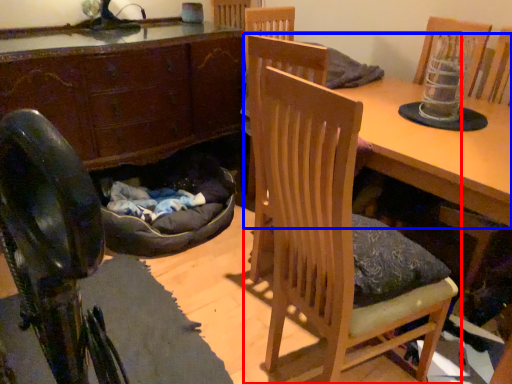
Question: Which point is further to the camera, chair (highlighted by a red box) or table (highlighted by a blue box)?

Choices:
 (A) chair
 (B) table

Answer: (B)